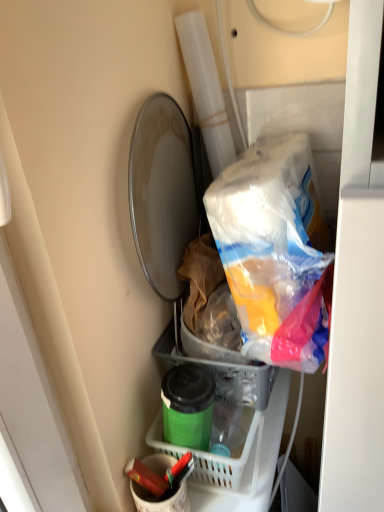
Find the location of a particular element. This screenshot has width=384, height=512. matte red crayon at lower center is located at coordinates (146, 477).

Where is `green matte container at lower center`? green matte container at lower center is located at coordinates click(188, 406).

Find the location of a particular element. This screenshot has width=384, height=512. green plastic basket at lower center is located at coordinates (218, 456).

I want to click on matte red crayon at lower center, so click(x=146, y=477).

Is matte white bucket at lower center taller than matte red crayon at lower center?

No, matte white bucket at lower center is not taller than matte red crayon at lower center.

Is matte red crayon at lower center at the back of matte white bucket at lower center?

Yes, matte white bucket at lower center is positioned with its back facing matte red crayon at lower center.

Which is nearer, (152, 468) or (137, 467)?

Clearly, point (152, 468) is more distant from the camera than point (137, 467).

Consider the image. Would you say matte white bucket at lower center is inside or outside matte red crayon at lower center?

matte white bucket at lower center exists outside the volume of matte red crayon at lower center.

Is green matte container at lower center in front of or behind green plastic basket at lower center in the image?

Clearly, green matte container at lower center is in front of green plastic basket at lower center.

Considering the points (165, 419) and (235, 459), which point is in front, point (165, 419) or point (235, 459)?

The point (165, 419) is closer to the camera.

Does green matte container at lower center have a larger size compared to green plastic basket at lower center?

No.

Can you confirm if green matte container at lower center is taller than green plastic basket at lower center?

Indeed, green matte container at lower center has a greater height compared to green plastic basket at lower center.

Visually, is green matte container at lower center positioned to the left or to the right of matte white bucket at lower center?

Based on their positions, green matte container at lower center is located to the right of matte white bucket at lower center.

The height and width of the screenshot is (512, 384). Identify the location of bottle located above the matte white bucket at lower center (from the image's perspective). (188, 406).

From a real-world perspective, is green matte container at lower center located higher than matte white bucket at lower center?

Yes.

How different are the orientations of green matte container at lower center and matte white bucket at lower center in degrees?

2.33 degrees separate the facing orientations of green matte container at lower center and matte white bucket at lower center.

From a real-world perspective, which object stands above the other?

From a 3D spatial view, matte white bucket at lower center is above.

From the image's perspective, does matte white bucket at lower center appear higher than green plastic basket at lower center?

No, from the image's perspective, matte white bucket at lower center is not above green plastic basket at lower center.

Based on the photo, is matte white bucket at lower center in contact with green plastic basket at lower center?

Yes, matte white bucket at lower center and green plastic basket at lower center clearly make contact.

Which is behind, matte white bucket at lower center or green plastic basket at lower center?

green plastic basket at lower center.

Consider the image. Between matte red crayon at lower center and matte white bucket at lower center, which one appears on the left side from the viewer's perspective?

From the viewer's perspective, matte red crayon at lower center appears more on the left side.

The height and width of the screenshot is (512, 384). Identify the location of crayon lying on the left of matte white bucket at lower center. (146, 477).

In terms of width, does matte red crayon at lower center look wider or thinner when compared to matte white bucket at lower center?

Clearly, matte red crayon at lower center has less width compared to matte white bucket at lower center.

From the image's perspective, which object appears higher, matte red crayon at lower center or matte white bucket at lower center?

matte red crayon at lower center, from the image's perspective.

Is matte red crayon at lower center bigger or smaller than green matte container at lower center?

Considering their sizes, matte red crayon at lower center takes up less space than green matte container at lower center.

In the image, is matte red crayon at lower center on the left side or the right side of green matte container at lower center?

matte red crayon at lower center is positioned on green matte container at lower center's left side.

From a real-world perspective, who is located lower, matte red crayon at lower center or green matte container at lower center?

From a 3D spatial view, matte red crayon at lower center is below.

Considering the positions of points (246, 429) and (166, 489), is point (246, 429) farther from camera compared to point (166, 489)?

That is True.

Considering the sizes of objects green plastic basket at lower center and matte red crayon at lower center in the image provided, who is taller, green plastic basket at lower center or matte red crayon at lower center?

With more height is matte red crayon at lower center.

Considering the relative positions of green plastic basket at lower center and matte red crayon at lower center in the image provided, is green plastic basket at lower center to the left or to the right of matte red crayon at lower center?

green plastic basket at lower center is to the right of matte red crayon at lower center.

In order to click on bucket in front of the matte red crayon at lower center in this screenshot , I will do `click(158, 499)`.

This screenshot has width=384, height=512. I want to click on bottle above the green plastic basket at lower center (from a real-world perspective), so click(188, 406).

Which object lies nearer to the anchor point matte red crayon at lower center, green plastic basket at lower center or green matte container at lower center?

green plastic basket at lower center.

Estimate the real-world distances between objects in this image. Which object is closer to green matte container at lower center, matte white bucket at lower center or matte red crayon at lower center?

Based on the image, matte white bucket at lower center appears to be nearer to green matte container at lower center.

From the image, which object appears to be farther from green matte container at lower center, matte red crayon at lower center or matte white bucket at lower center?

Among the two, matte red crayon at lower center is located further to green matte container at lower center.

Estimate the real-world distances between objects in this image. Which object is closer to matte red crayon at lower center, green plastic basket at lower center or matte white bucket at lower center?

matte white bucket at lower center lies closer to matte red crayon at lower center than the other object.

Which object lies nearer to the anchor point green plastic basket at lower center, green matte container at lower center or matte white bucket at lower center?

green matte container at lower center is positioned closer to the anchor green plastic basket at lower center.

Consider the image. From the image, which object appears to be nearer to matte red crayon at lower center, green matte container at lower center or green plastic basket at lower center?

Based on the image, green plastic basket at lower center appears to be nearer to matte red crayon at lower center.

Based on their spatial positions, is green matte container at lower center or matte red crayon at lower center further from green plastic basket at lower center?

matte red crayon at lower center.

Considering their positions, is green plastic basket at lower center positioned closer to green matte container at lower center than matte white bucket at lower center?

green plastic basket at lower center is positioned closer to the anchor green matte container at lower center.

Locate an element on the screen. basket between green matte container at lower center and matte white bucket at lower center vertically is located at coordinates (218, 456).

Locate an element on the screen. Image resolution: width=384 pixels, height=512 pixels. crayon between green matte container at lower center and matte white bucket at lower center vertically is located at coordinates (146, 477).

Identify the location of basket between green matte container at lower center and matte red crayon at lower center in the vertical direction. (218, 456).

What are the coordinates of `bucket between matte red crayon at lower center and green plastic basket at lower center` in the screenshot? It's located at (158, 499).